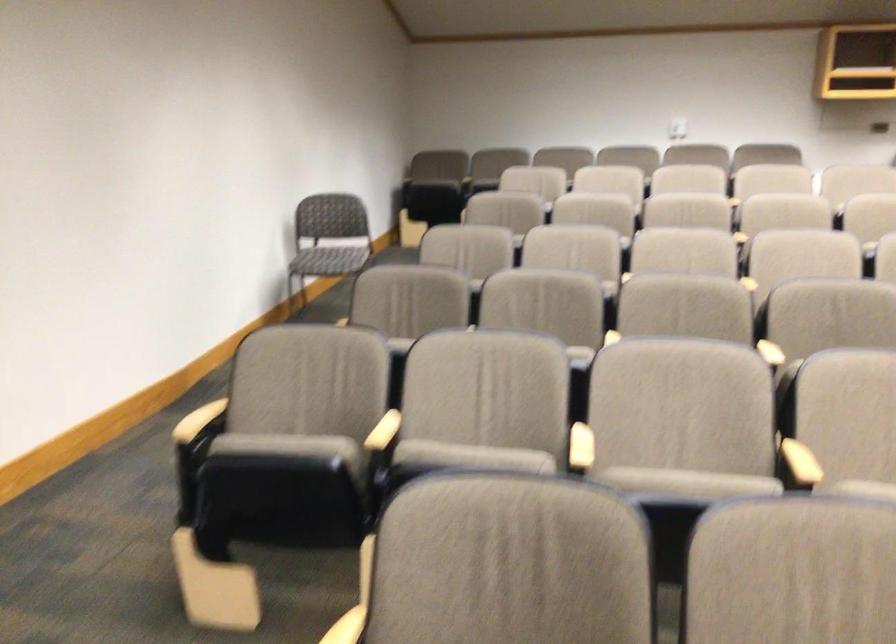
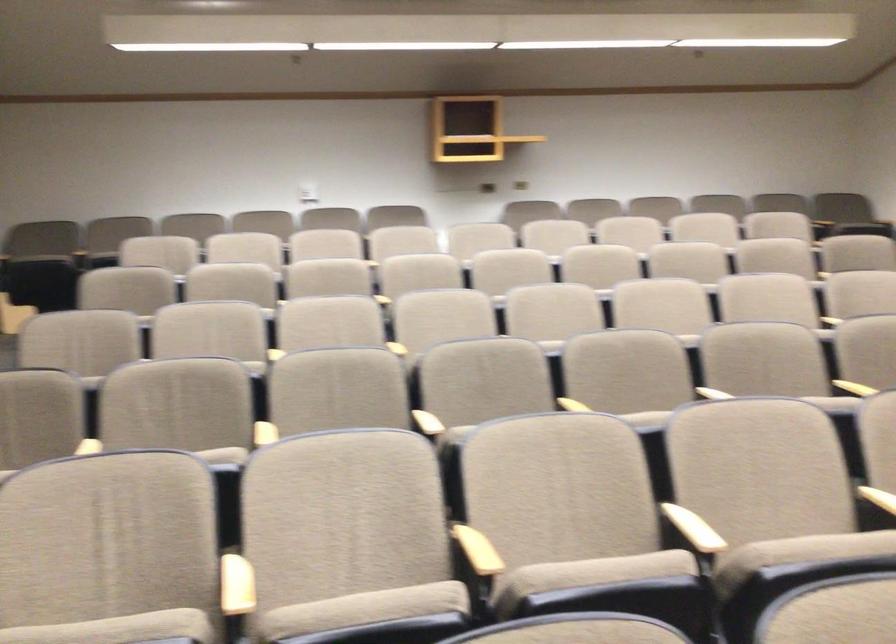
Question: The camera is either moving clockwise (left) or counter-clockwise (right) around the object. The first image is from the beginning of the video and the second image is from the end. Is the camera moving left or right when shooting the video?

Choices:
 (A) Left
 (B) Right

Answer: (A)